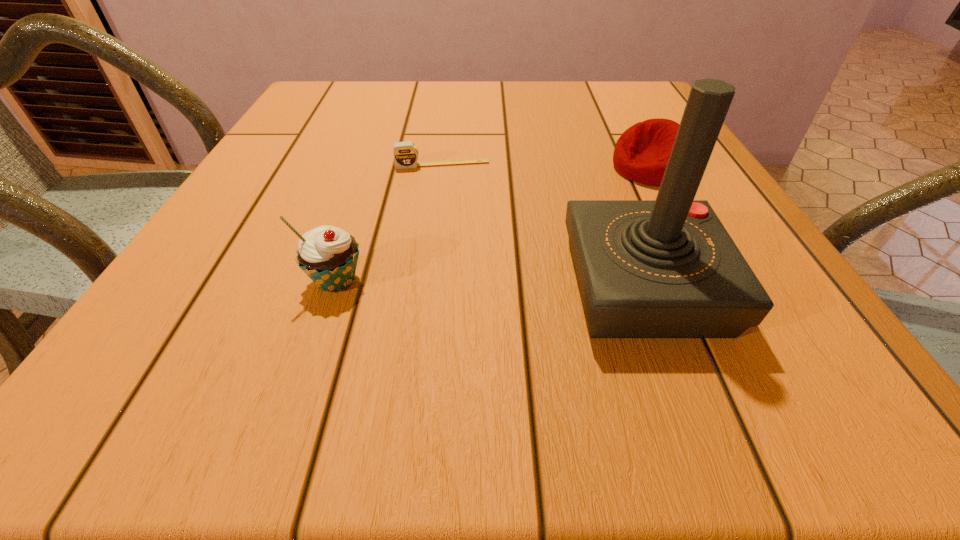
Where is `vacant space in between the cupcake and the joystick`? The image size is (960, 540). vacant space in between the cupcake and the joystick is located at coordinates (491, 284).

The image size is (960, 540). In order to click on blank region between the third shortest object and the tallest object in this screenshot , I will do `click(491, 284)`.

The height and width of the screenshot is (540, 960). In order to click on vacant space in between the tallest object and the shortest object in this screenshot , I will do `click(543, 226)`.

Locate an element on the screen. This screenshot has width=960, height=540. object that is the second closest to the shortest object is located at coordinates (667, 268).

Locate an element on the screen. object that ranks as the third closest to the tallest object is located at coordinates (328, 255).

Identify the location of vacant point that satisfies the following two spatial constraints: 1. on the front side of the joystick; 2. on the rectangular base of the cupcake. (334, 286).

What are the coordinates of `vacant area in the image that satisfies the following two spatial constraints: 1. on the front side of the joystick; 2. on the rectangular base of the third shortest object` in the screenshot? It's located at (334, 286).